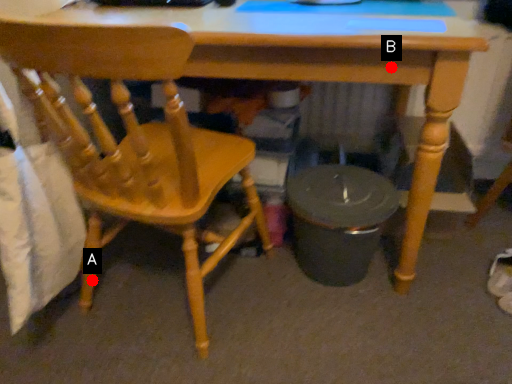
Question: Two points are circled on the image, labeled by A and B beside each circle. Among these points, which one is nearest to the camera?

Choices:
 (A) A is closer
 (B) B is closer

Answer: (B)